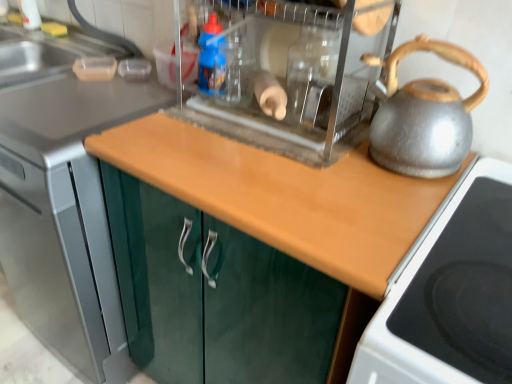
Question: Is silver metallic kettle at right inside or outside of black glass cooktop at right?

Choices:
 (A) outside
 (B) inside

Answer: (A)

Question: Looking at their shapes, would you say silver metallic kettle at right is wider or thinner than black glass cooktop at right?

Choices:
 (A) thin
 (B) wide

Answer: (A)

Question: Estimate the real-world distances between objects in this image. Which object is closer to the silver metallic kettle at right?

Choices:
 (A) metallic silver kettle at right
 (B) black glass cooktop at right
 (C) matte gray sink at upper left
 (D) blue plastic bottle at center
 (E) wooden at center, which is the 2th countertop in right-to-left order

Answer: (B)

Question: Estimate the real-world distances between objects in this image. Which object is closer to the wooden at center, which is the 2th countertop in right-to-left order?

Choices:
 (A) wooden at center, the first countertop when ordered from right to left
 (B) blue plastic bottle at center
 (C) black glass cooktop at right
 (D) matte gray sink at upper left
 (E) silver metallic kettle at right

Answer: (A)